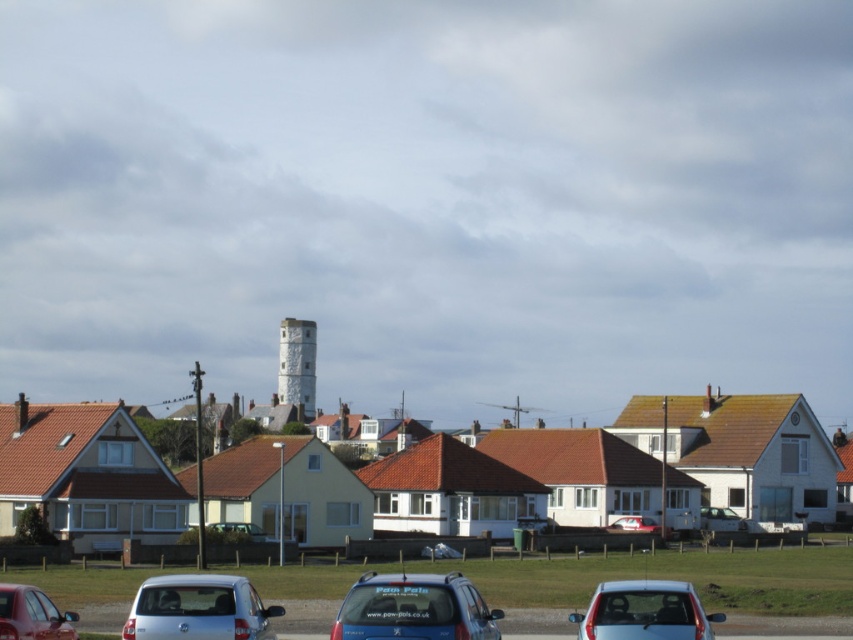
Is metallic silver car at center above satin silver car at lower left?

Incorrect, metallic silver car at center is not positioned above satin silver car at lower left.

Identify the location of metallic silver car at center. The image size is (853, 640). (664, 577).

Identify the location of metallic silver car at center. The height and width of the screenshot is (640, 853). (664, 577).

Can you confirm if metallic silver car at center is positioned below white textured tower at center?

Indeed, metallic silver car at center is positioned under white textured tower at center.

Can you confirm if metallic silver car at center is thinner than white textured tower at center?

No.

Locate an element on the screen. metallic silver car at center is located at coordinates tap(664, 577).

Where is `metallic silver car at center`? metallic silver car at center is located at coordinates (664, 577).

Looking at this image, is metallic blue sedan at lower center shorter than white matte car at lower right?

No.

Can you confirm if metallic blue sedan at lower center is smaller than white matte car at lower right?

No.

Which is in front, point (601, 627) or point (741, 520)?

Positioned in front is point (601, 627).

Identify the location of metallic blue sedan at lower center. (643, 611).